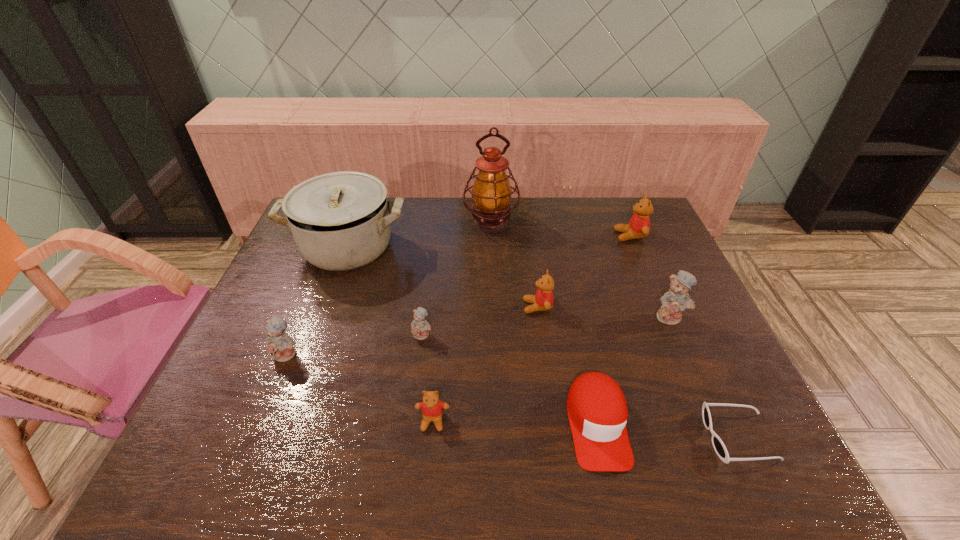
Where is `free space between the oil lamp and the baseball cap`? The image size is (960, 540). free space between the oil lamp and the baseball cap is located at coordinates (544, 323).

You are a GUI agent. You are given a task and a screenshot of the screen. Output one action in this format:
    pyautogui.click(x=<x>, y=<y>)
    Task: Click on the unoccupied position between the leftmost blue teddy bear and the farthest teddy bear
    Image resolution: width=960 pixels, height=540 pixels.
    Given the screenshot: What is the action you would take?
    pyautogui.click(x=459, y=295)

Identify the location of vacant point located between the farthest teddy bear and the oil lamp. (561, 229).

At what (x,y) coordinates should I click in order to perform the action: click on free space between the second tallest object and the black sunglasses. Please return your answer as a coordinate pair (x, y). Image resolution: width=960 pixels, height=540 pixels. Looking at the image, I should click on (543, 342).

This screenshot has height=540, width=960. I want to click on vacant area that lies between the second nearest teddy bear and the farthest teddy bear, so click(x=459, y=295).

Locate an element on the screen. free space that is in between the rightmost red teddy bear and the oil lamp is located at coordinates (561, 229).

Find the location of a particular element. The image size is (960, 540). vacant area that lies between the baseball cap and the second smallest blue teddy bear is located at coordinates (442, 389).

Identify which object is located as the ninth nearest to the fifth farthest teddy bear. Please provide its 2D coordinates. Your answer should be formatted as a tuple, i.e. [(x, y)], where the tuple contains the x and y coordinates of a point satisfying the conditions above.

[(638, 227)]

Select which object appears as the fifth closest to the leftmost blue teddy bear. Please provide its 2D coordinates. Your answer should be formatted as a tuple, i.e. [(x, y)], where the tuple contains the x and y coordinates of a point satisfying the conditions above.

[(491, 193)]

Identify the location of teddy bear that is the fourth nearest to the shortest object. [x=638, y=227].